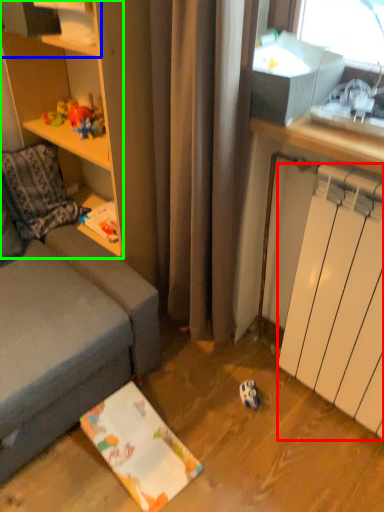
Question: Which is farther away from radiator (highlighted by a red box)? shelf (highlighted by a blue box) or cabinetry (highlighted by a green box)?

Choices:
 (A) shelf
 (B) cabinetry

Answer: (A)